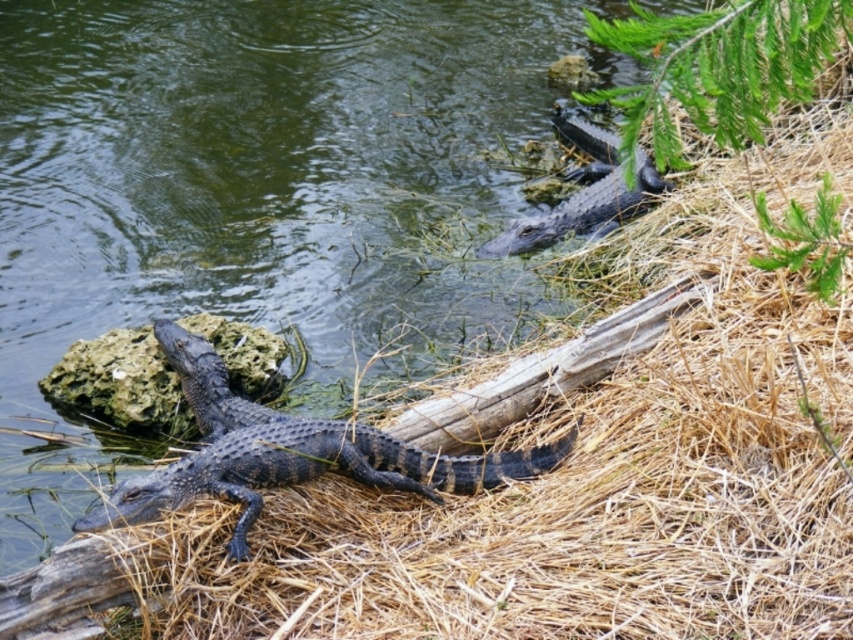
Which is behind, point (463, 470) or point (149, 348)?

The point (149, 348) is behind.

Between shiny black crocodile at center and gray rock at center, which one is positioned lower?

shiny black crocodile at center is below.

What do you see at coordinates (289, 452) in the screenshot? This screenshot has width=853, height=640. I see `shiny black crocodile at center` at bounding box center [289, 452].

Where is `shiny black crocodile at center`? shiny black crocodile at center is located at coordinates (289, 452).

Does shiny black crocodile at center appear on the left side of shiny black crocodile at upper right?

Indeed, shiny black crocodile at center is positioned on the left side of shiny black crocodile at upper right.

From the picture: Which is more to the right, shiny black crocodile at center or shiny black crocodile at upper right?

shiny black crocodile at upper right

The image size is (853, 640). I want to click on shiny black crocodile at center, so click(x=289, y=452).

Between gray rock at center and shiny black crocodile at upper right, which one is positioned higher?

Positioned higher is shiny black crocodile at upper right.

Is gray rock at center below shiny black crocodile at upper right?

Indeed, gray rock at center is positioned under shiny black crocodile at upper right.

Find the location of a particular element. gray rock at center is located at coordinates (122, 381).

The height and width of the screenshot is (640, 853). What are the coordinates of `gray rock at center` in the screenshot? It's located at (122, 381).